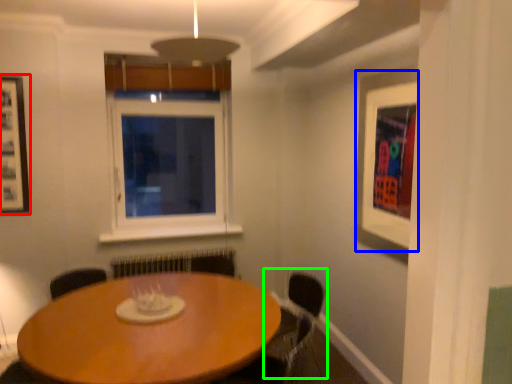
Question: Which is nearer to the picture frame (highlighted by a red box)? picture frame (highlighted by a blue box) or armchair (highlighted by a green box).

Choices:
 (A) picture frame
 (B) armchair

Answer: (B)